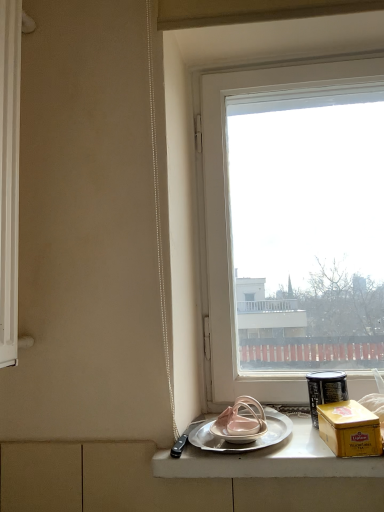
Locate an element on the screen. vacant area that lies between silver metallic plate at lower center and yellow matte box at right is located at coordinates pyautogui.click(x=305, y=444).